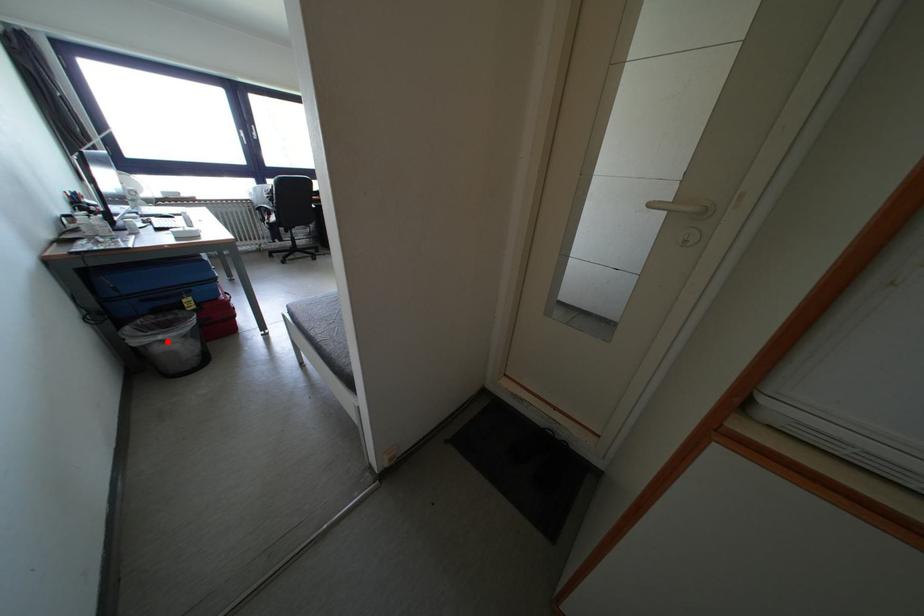
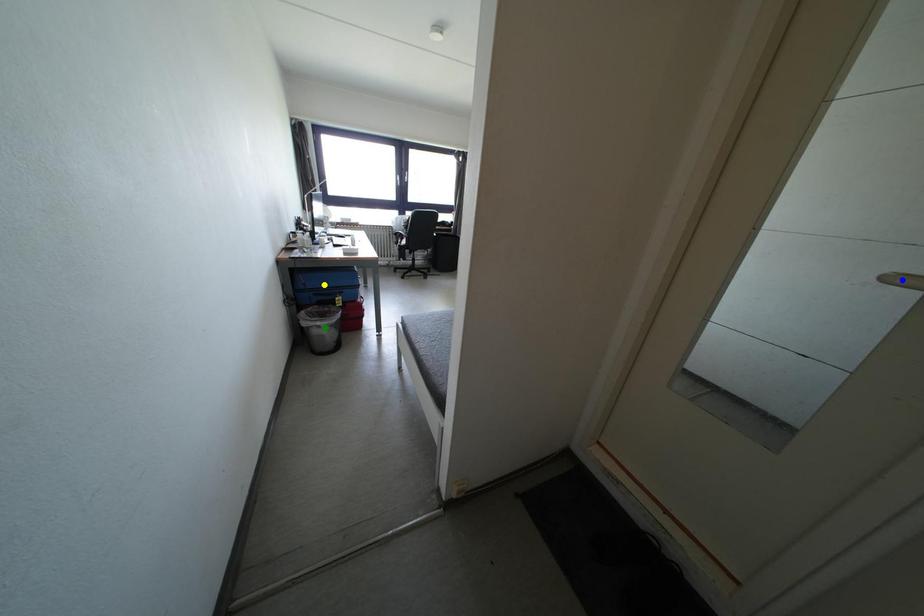
Question: I am providing you with two images of the same scene from different viewpoints. A red point is marked on the first image. You are given multiple points on the second image. Which point in image 2 is actually the same real-world point as the red point in image 1?

Choices:
 (A) yellow point
 (B) blue point
 (C) green point

Answer: (C)